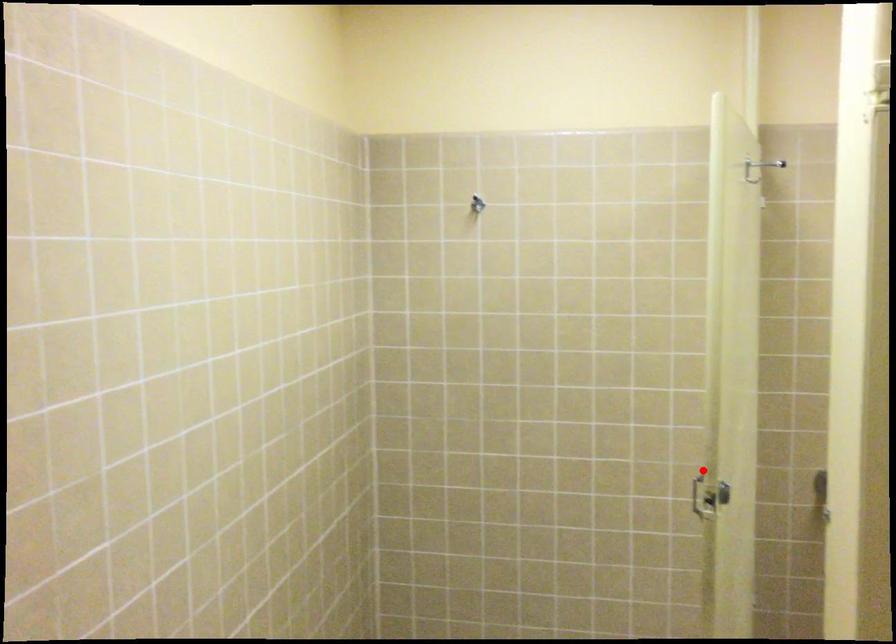
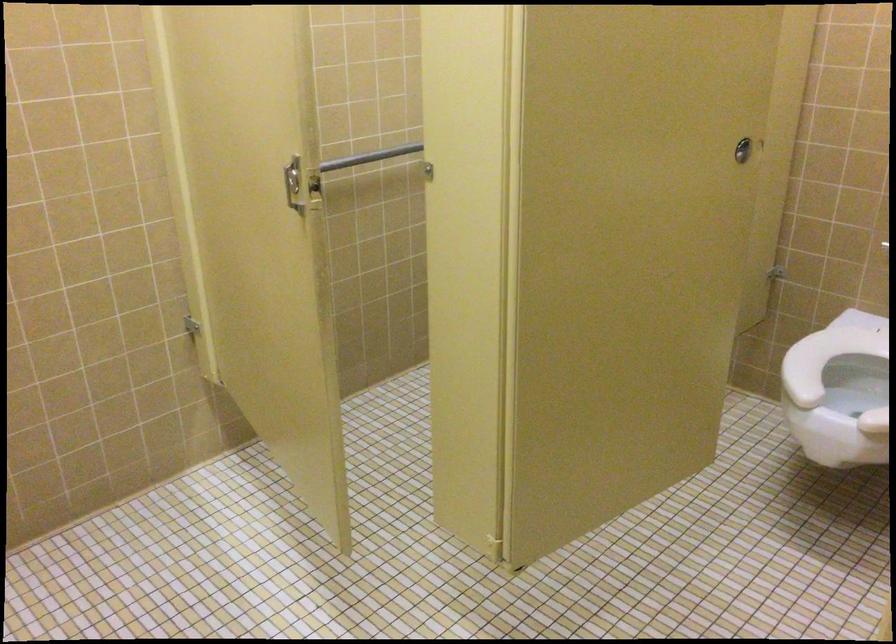
Question: A red point is marked in image1. In image2, is the corresponding 3D point closer to the camera or farther? Reply with the corresponding letter.

Choices:
 (A) The corresponding 3D point is closer.
 (B) The corresponding 3D point is farther.

Answer: (A)